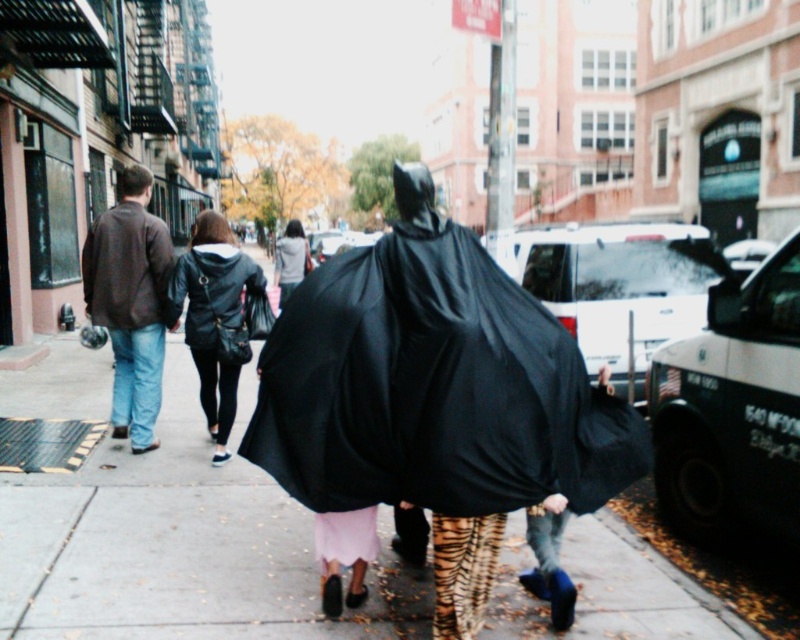
Question: Is black matte cape at center wider than matte black cape at left?

Choices:
 (A) no
 (B) yes

Answer: (B)

Question: Which point is farther to the camera?

Choices:
 (A) (154, 291)
 (B) (288, 244)

Answer: (B)

Question: Which of the following is the closest to the observer?

Choices:
 (A) light gray hoodie at center
 (B) gray concrete sidewalk at center
 (C) black matte cape at center

Answer: (C)

Question: Can you confirm if black matte cape at center is positioned to the right of matte black cape at left?

Choices:
 (A) no
 (B) yes

Answer: (B)

Question: Does gray concrete sidewalk at center lie in front of light gray hoodie at center?

Choices:
 (A) yes
 (B) no

Answer: (A)

Question: Which object appears farthest from the camera in this image?

Choices:
 (A) leather/black jacket at center
 (B) matte black cape at left
 (C) light gray hoodie at center

Answer: (C)